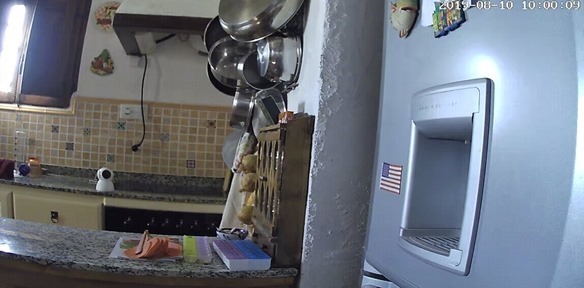
Find the location of a particular element. Image resolution: width=584 pixels, height=288 pixels. fridge magnets is located at coordinates (439, 22), (390, 19).